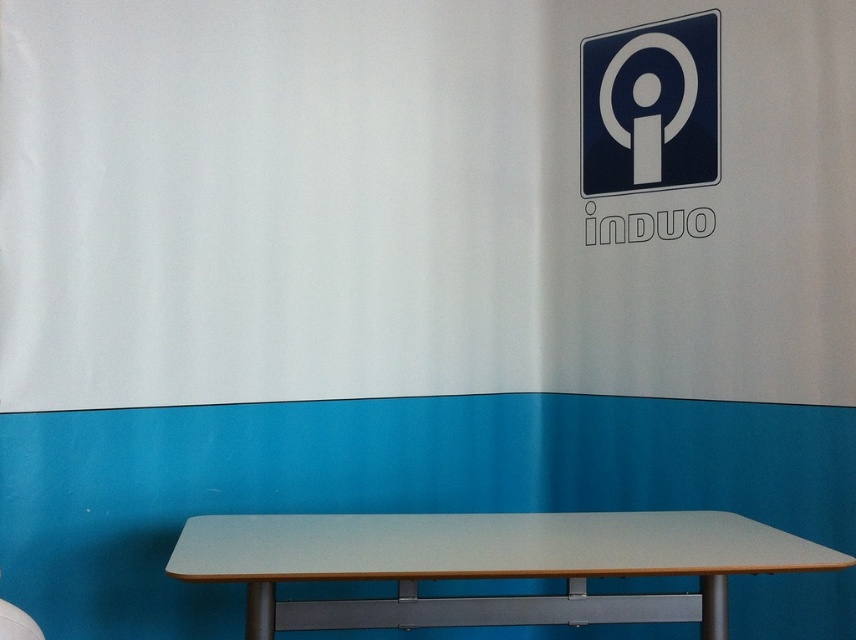
From the picture: You are organizing a meeting in this room and need to place a large presentation board on the table. Given the light gray laminate table at center and the blue glossy sign at upper right, which object can accommodate the board based on their sizes?

The light gray laminate table at center has a larger size compared to the blue glossy sign at upper right, so the presentation board should be placed on the light gray laminate table at center.

In the scene shown: You are standing in the room facing the wall with the logo. There is a point marked at coordinates [486,564]. What object is located at this point?

The point at coordinates [486,564] corresponds to the light gray laminate table at center.

You are standing in the room and want to place a small plant on the light gray laminate table at center. Based on the coordinates provided, is the table positioned closer to the upper white wall section or the lower blue wall section?

The light gray laminate table at center is located at point (486, 564). Since the coordinates are given in a normalized system where 0 is the bottom and 1 is the top, the y coordinate of 0.570 places it closer to the upper white wall section than the lower blue section.